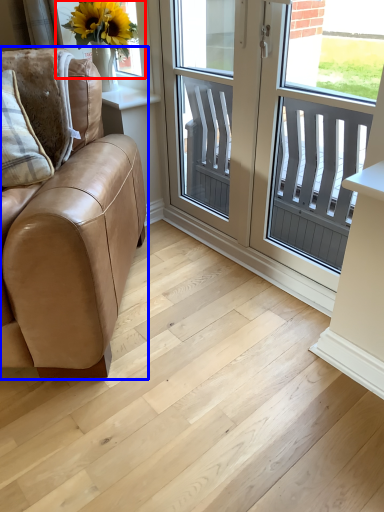
Question: Among these objects, which one is nearest to the camera, window screen (highlighted by a red box) or studio couch (highlighted by a blue box)?

Choices:
 (A) window screen
 (B) studio couch

Answer: (B)